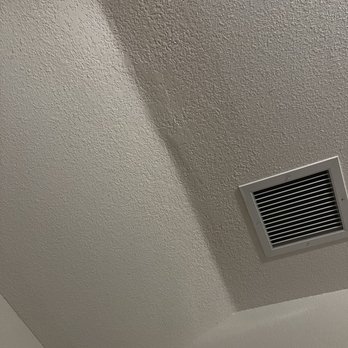
Where is `bottom vent border`? The width and height of the screenshot is (348, 348). bottom vent border is located at coordinates (325, 241).